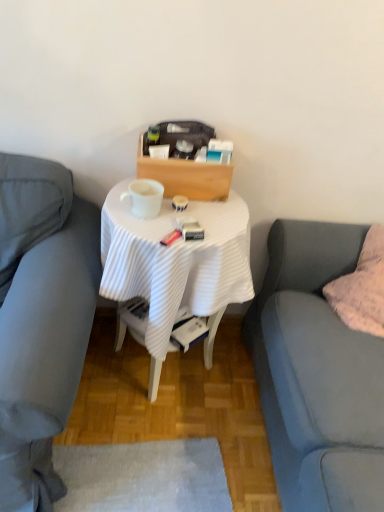
Where is `unoccupied area in front of white ribbed cloth at center`? Image resolution: width=384 pixels, height=512 pixels. unoccupied area in front of white ribbed cloth at center is located at coordinates (171, 461).